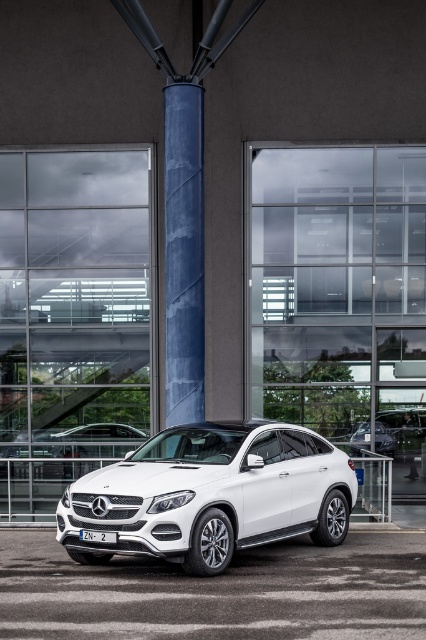
Question: Which point is closer to the camera?

Choices:
 (A) white glossy parking lot at center
 (B) white metallic car at center
 (C) blue textured column at center

Answer: (A)

Question: Among these points, which one is nearest to the camera?

Choices:
 (A) (264, 422)
 (B) (178, 632)

Answer: (B)

Question: Based on their relative distances, which object is farther from the white metallic car at center?

Choices:
 (A) blue textured column at center
 (B) white glossy parking lot at center

Answer: (A)

Question: Is white glossy parking lot at center bigger than white metallic car at center?

Choices:
 (A) yes
 (B) no

Answer: (B)

Question: Is white metallic car at center positioned at the back of blue textured column at center?

Choices:
 (A) yes
 (B) no

Answer: (B)

Question: Is white metallic car at center wider than blue textured column at center?

Choices:
 (A) no
 (B) yes

Answer: (B)